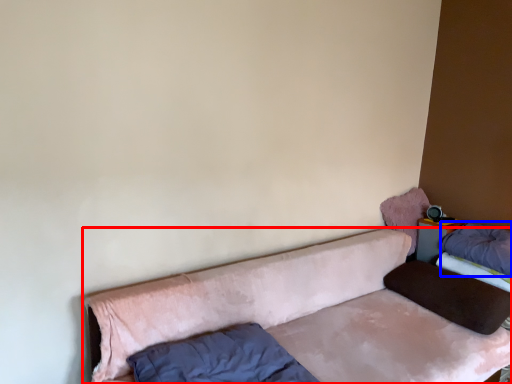
Question: Which point is closer to the camera, studio couch (highlighted by a red box) or pillow (highlighted by a blue box)?

Choices:
 (A) studio couch
 (B) pillow

Answer: (A)